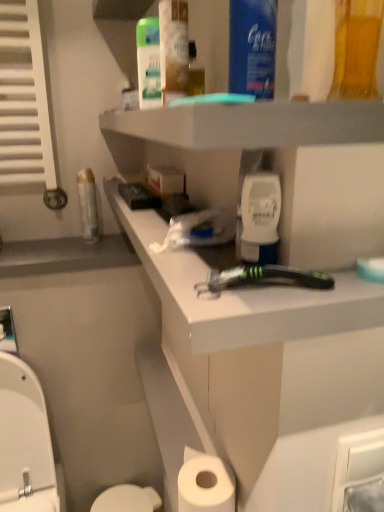
Locate an element on the screen. This screenshot has width=384, height=512. free spot in front of clear plastic bottle at left, which is the 1th mouthwash in left-to-right order is located at coordinates (69, 253).